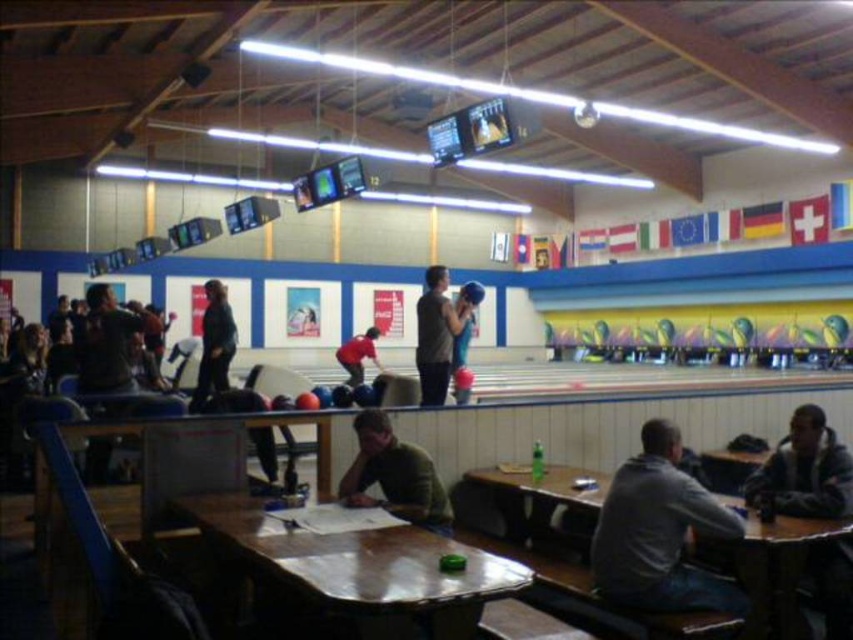
You are a photographer standing at the entrance of the indoor bowling alley. You want to take a photo of the gray cotton shirt at lower right and the dark gray jacket at lower right. Which one will appear taller in the photo?

The gray cotton shirt at lower right will appear taller in the photo because it is taller than the dark gray jacket at lower right according to the description.

In the scene shown: You are standing in the indoor bowling alley and want to determine the relative positions of two points marked in the scene. Which of the two points, point 1 at coordinates [256,532] or point 2 at coordinates [440,387], is closer to you?

Point 1 at coordinates [256,532] is closer to you than point 2 at coordinates [440,387].